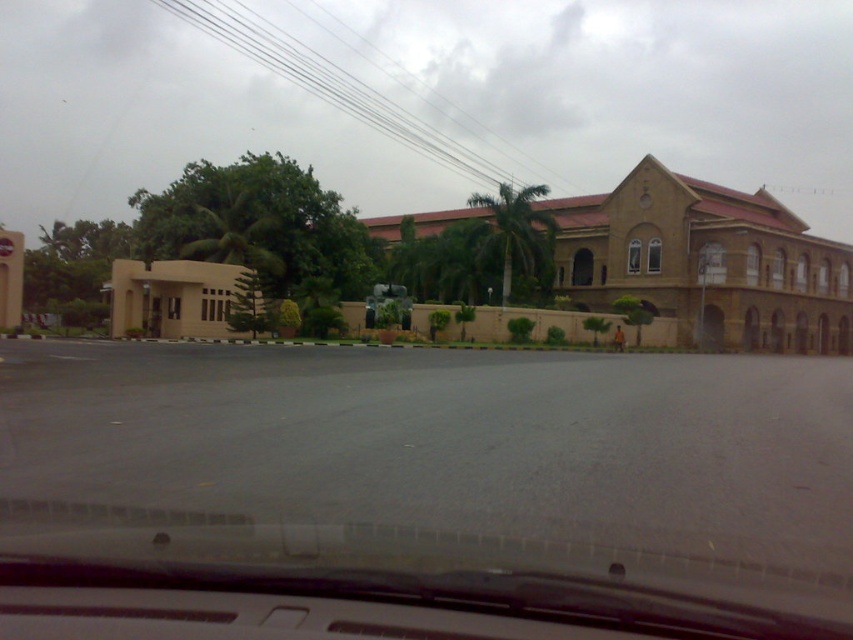
In the scene shown: Between transparent glass windshield at center and brown stone church at center, which one appears on the left side from the viewer's perspective?

transparent glass windshield at center is more to the left.

Who is more forward, (x=502, y=456) or (x=747, y=205)?

Positioned in front is point (x=502, y=456).

Find the location of a particular element. The width and height of the screenshot is (853, 640). transparent glass windshield at center is located at coordinates (421, 493).

Does point (146, 484) lie in front of point (229, 275)?

Yes.

Does transparent glass windshield at center lie behind beige matte building at left?

No, transparent glass windshield at center is in front of beige matte building at left.

Is point (651, 412) in front of point (167, 285)?

Yes, it is.

The image size is (853, 640). What are the coordinates of `transparent glass windshield at center` in the screenshot? It's located at (421, 493).

Who is more forward, (x=642, y=218) or (x=170, y=301)?

Answer: Point (x=170, y=301) is more forward.

I want to click on brown stone church at center, so click(705, 260).